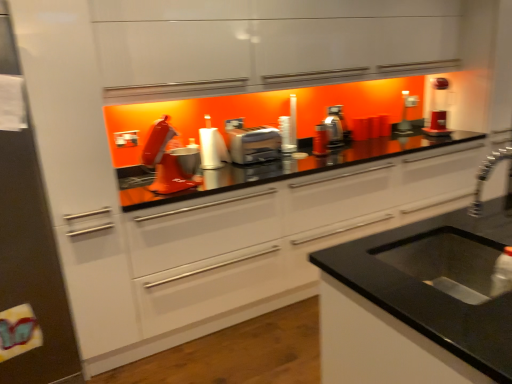
Question: Should I look upward or downward to see matte white toaster at center?

Choices:
 (A) up
 (B) down

Answer: (A)

Question: Could you tell me if white matte refrigerator at left is facing matte white toaster at center?

Choices:
 (A) no
 (B) yes

Answer: (A)

Question: Is white matte refrigerator at left not near matte white toaster at center?

Choices:
 (A) no
 (B) yes

Answer: (B)

Question: Considering the relative sizes of white matte refrigerator at left and matte white toaster at center in the image provided, is white matte refrigerator at left wider than matte white toaster at center?

Choices:
 (A) yes
 (B) no

Answer: (A)

Question: Does white matte refrigerator at left contain matte white toaster at center?

Choices:
 (A) no
 (B) yes

Answer: (A)

Question: Is the depth of white matte refrigerator at left greater than that of matte white toaster at center?

Choices:
 (A) yes
 (B) no

Answer: (B)

Question: From a real-world perspective, is white matte refrigerator at left below matte white toaster at center?

Choices:
 (A) no
 (B) yes

Answer: (B)

Question: From the image's perspective, is matte red coffee maker at upper right on top of metallic silver toaster at center, arranged as the 1th appliance when viewed from the right?

Choices:
 (A) no
 (B) yes

Answer: (B)

Question: Does matte red coffee maker at upper right turn towards metallic silver toaster at center, the 1th appliance in the top-to-bottom sequence?

Choices:
 (A) no
 (B) yes

Answer: (A)

Question: Is matte red coffee maker at upper right taller than metallic silver toaster at center, the 1th appliance in the top-to-bottom sequence?

Choices:
 (A) no
 (B) yes

Answer: (B)

Question: From a real-world perspective, is matte red coffee maker at upper right on metallic silver toaster at center, the second appliance when ordered from bottom to top?

Choices:
 (A) yes
 (B) no

Answer: (A)

Question: From the image's perspective, is matte red coffee maker at upper right below metallic silver toaster at center, the 1th appliance in the top-to-bottom sequence?

Choices:
 (A) yes
 (B) no

Answer: (B)

Question: Is matte red coffee maker at upper right behind metallic silver toaster at center, the 1th appliance in the back-to-front sequence?

Choices:
 (A) no
 (B) yes

Answer: (A)

Question: Can you confirm if black granite sink at lower right is wider than metallic silver toaster at center, which is the 2th appliance from front to back?

Choices:
 (A) yes
 (B) no

Answer: (A)